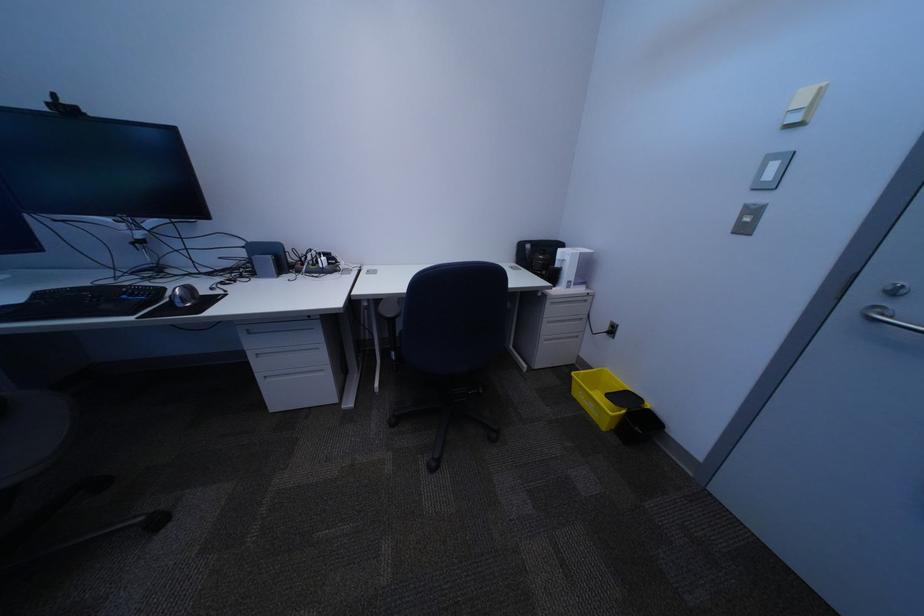
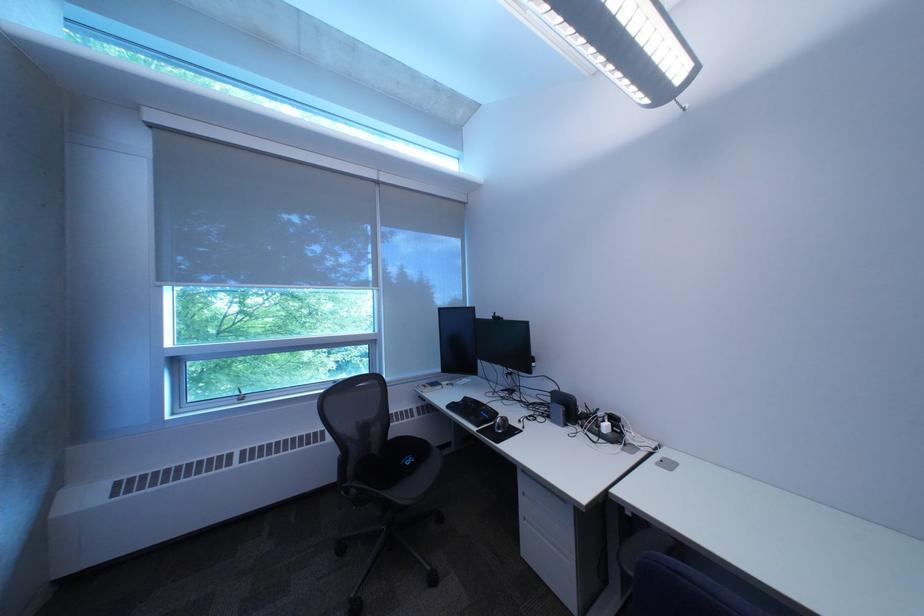
Locate, in the second image, the point that corresponds to point 148,315 in the first image.

(492, 429)